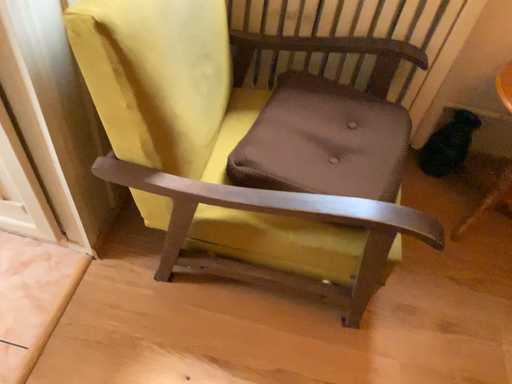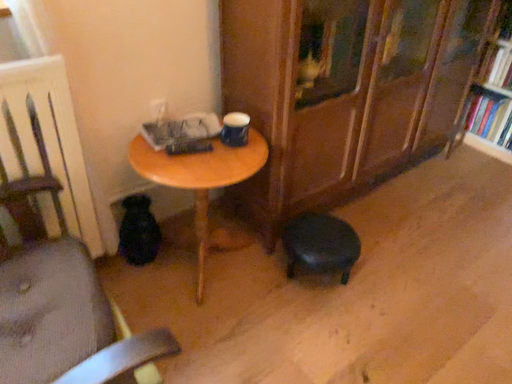
Question: How did the camera likely rotate when shooting the video?

Choices:
 (A) rotated downward
 (B) rotated upward

Answer: (B)